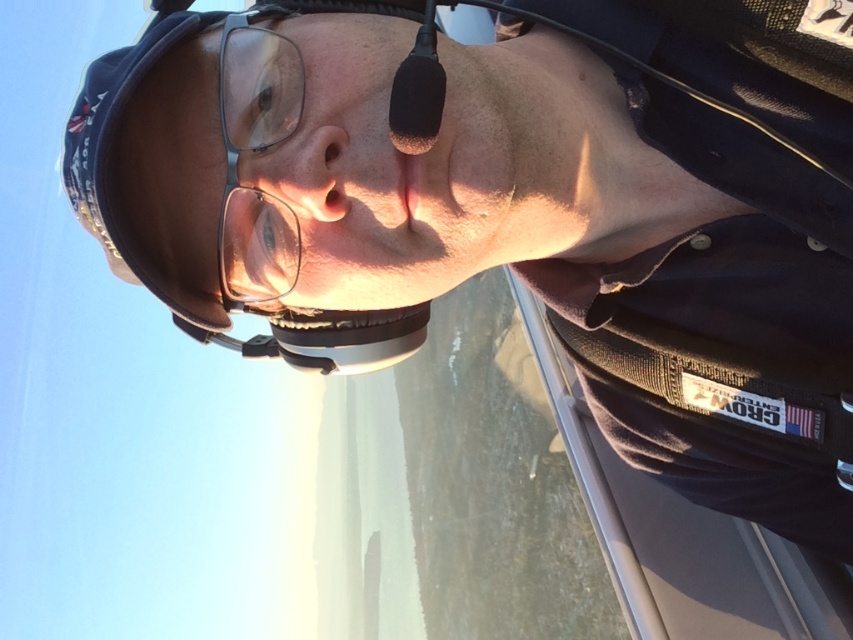
Between black fabric helmet at left and clear plastic glasses at center, which one has less height?

clear plastic glasses at center

Is black fabric helmet at left above clear plastic glasses at center?

No, black fabric helmet at left is not above clear plastic glasses at center.

Find the location of a particular element. The image size is (853, 640). black fabric helmet at left is located at coordinates (231, 195).